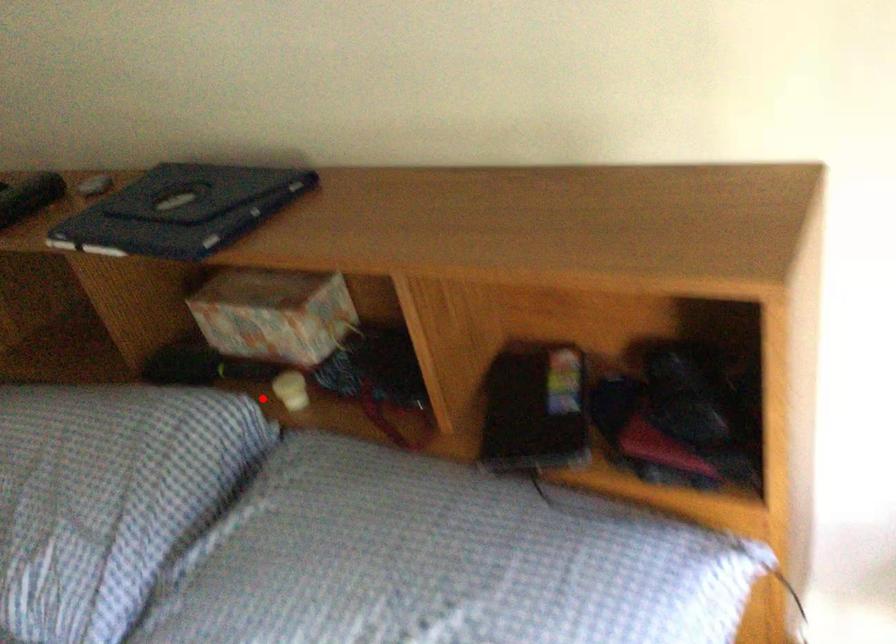
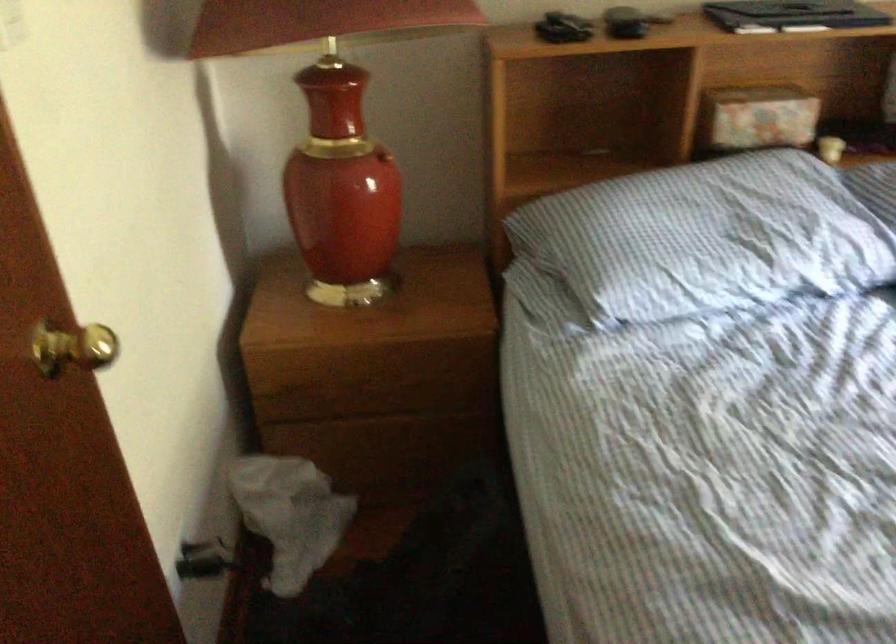
Question: I am providing you with two images of the same scene from different viewpoints. Given a red point in image1, look at the same physical point in image2. Is it:

Choices:
 (A) Closer to the viewpoint
 (B) Farther from the viewpoint

Answer: (B)